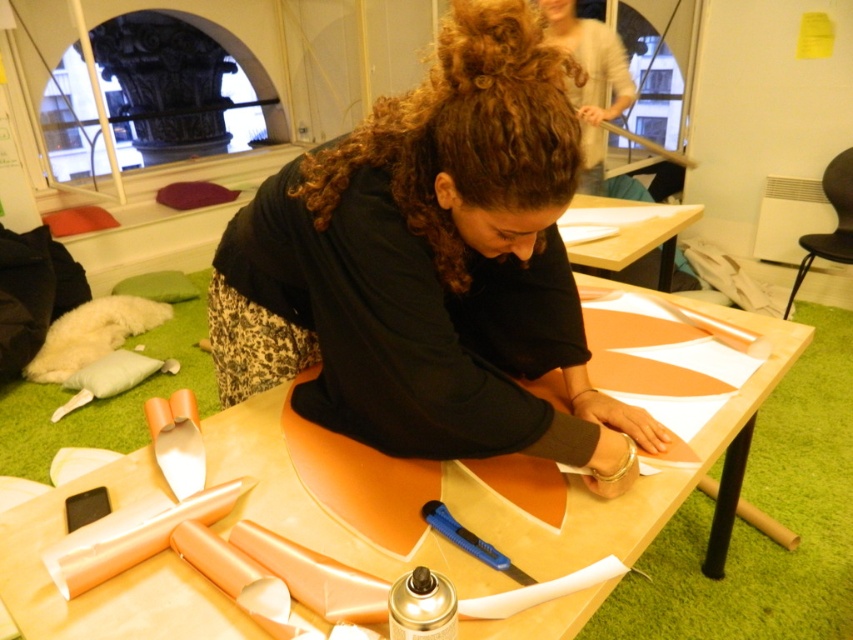
Question: Among these points, which one is farthest from the camera?

Choices:
 (A) (590, 51)
 (B) (235, 472)
 (C) (347, 376)
 (D) (627, 256)

Answer: (A)

Question: Can you confirm if matte white shirt at upper center is smaller than wooden table at upper center?

Choices:
 (A) yes
 (B) no

Answer: (B)

Question: Which point appears closest to the camera in this image?

Choices:
 (A) (589, 195)
 (B) (573, 477)
 (C) (360, 365)

Answer: (C)

Question: Which point is farther to the camera?

Choices:
 (A) (541, 538)
 (B) (524, 256)
 (C) (669, 262)
 (D) (563, 13)

Answer: (D)

Question: Where is matte orange table at center located in relation to wooden table at upper center in the image?

Choices:
 (A) above
 (B) below

Answer: (B)

Question: Is the position of black matte shirt at center more distant than that of matte orange table at center?

Choices:
 (A) no
 (B) yes

Answer: (B)